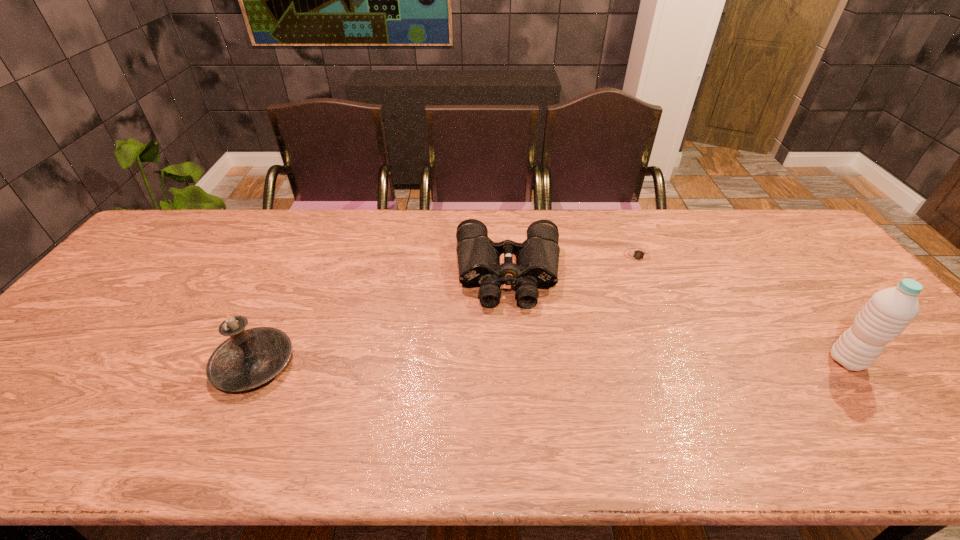
The image size is (960, 540). What are the coordinates of `free spot on the desktop that is between the second tallest object and the water bottle and is positioned through the eyepieces of the third tallest object` in the screenshot? It's located at (514, 362).

Locate an element on the screen. free space on the desktop that is between the candle and the tallest object and is positioned on the face of the watch is located at coordinates (623, 362).